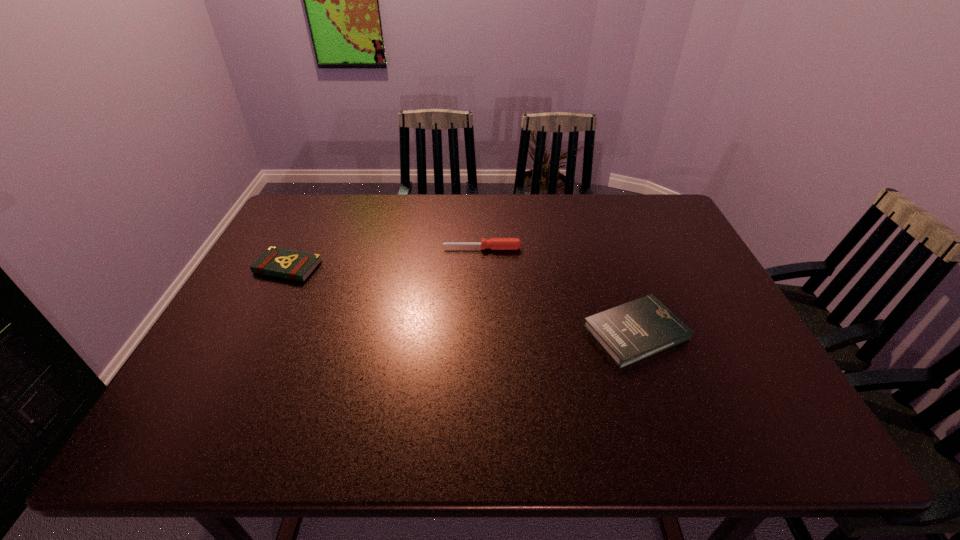
The width and height of the screenshot is (960, 540). Find the location of `vacant space that satisfies the following two spatial constraints: 1. on the back side of the screwdriver; 2. on the left side of the left book`. vacant space that satisfies the following two spatial constraints: 1. on the back side of the screwdriver; 2. on the left side of the left book is located at coordinates (298, 248).